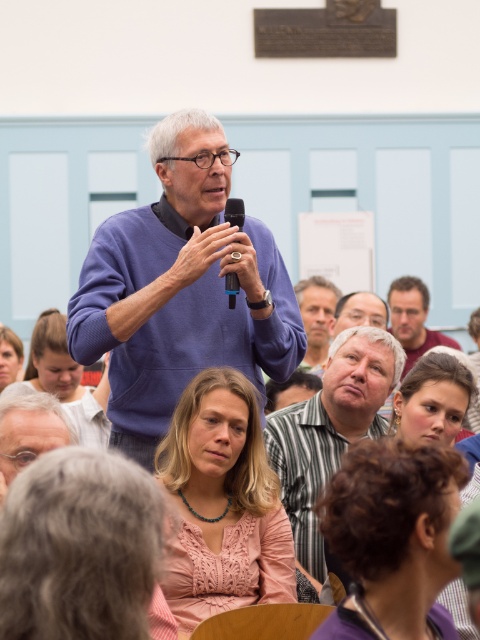
You are a photographer taking a picture of the speaker. You notice the matte brown hair at lower right and the black plastic microphone at center. Which object is wider in the image?

The matte brown hair at lower right is wider than the black plastic microphone at center.